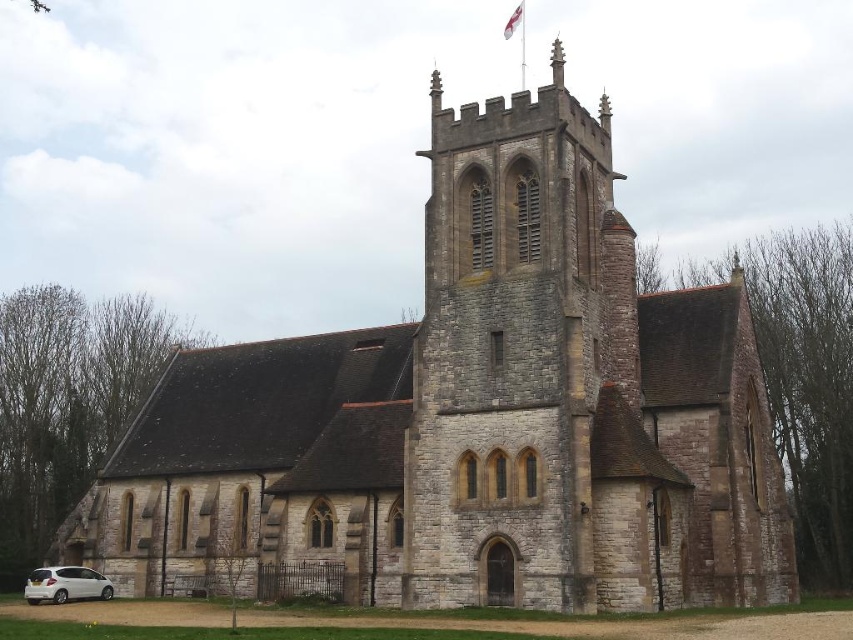
You are standing in front of the church and want to take a photo of the white matte hatchback at lower left and the white fabric flag at upper center. Which object should you focus on first if you want both to be in clear focus?

You should focus on the white matte hatchback at lower left first because it is closer to you than the white fabric flag at upper center, so adjusting focus from near to far will help both be in clear focus.

You are standing in front of the church and want to take a photo of the white matte hatchback at lower left and the white fabric flag at upper center. Which object should you focus on first if you want both to be in sharp focus?

The white matte hatchback at lower left is larger in size compared to the white fabric flag at upper center, so you should focus on the white matte hatchback at lower left first to ensure both are in sharp focus.

You are a photographer positioned at the base of the church tower. You want to capture both the white matte hatchback at lower left and the white fabric flag at upper center in a single frame. Which object will appear larger in the photo?

The white matte hatchback at lower left will appear larger in the photo because it is taller than the white fabric flag at upper center.